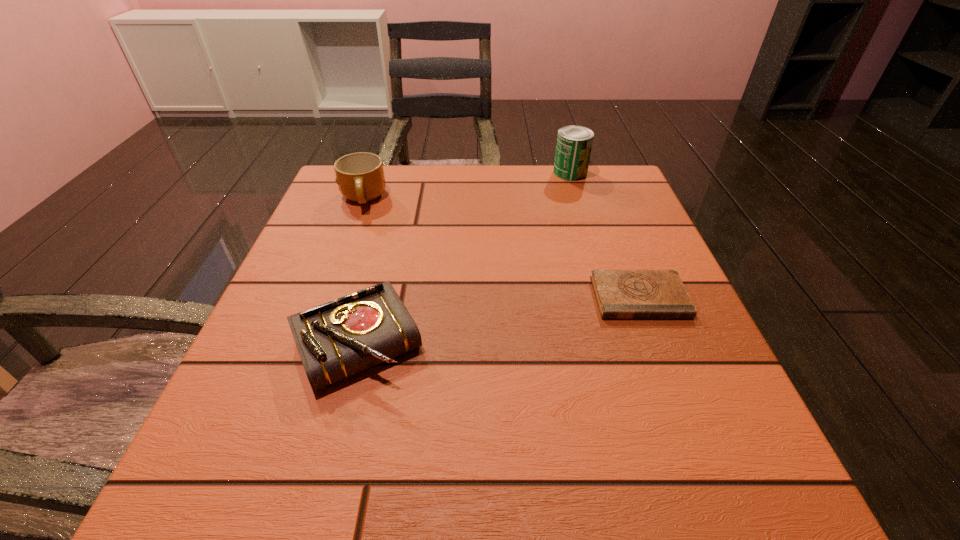
What are the coordinates of `blank space at the far edge of the desktop` in the screenshot? It's located at (539, 188).

The image size is (960, 540). Find the location of `free region at the near edge`. free region at the near edge is located at coordinates (x=425, y=449).

What are the coordinates of `vacant space at the left edge of the desktop` in the screenshot? It's located at (347, 268).

In the image, there is a desktop. Where is `vacant space at the right edge`? Image resolution: width=960 pixels, height=540 pixels. vacant space at the right edge is located at coordinates (586, 265).

Locate an element on the screen. The width and height of the screenshot is (960, 540). free space at the far right corner of the desktop is located at coordinates (579, 186).

This screenshot has width=960, height=540. What are the coordinates of `free space at the near right corner of the desktop` in the screenshot? It's located at (666, 510).

Find the location of a particular element. Image resolution: width=960 pixels, height=540 pixels. vacant space that's between the shorter diary and the taller diary is located at coordinates (498, 320).

The height and width of the screenshot is (540, 960). I want to click on free space between the second shortest object and the shortest object, so click(x=498, y=320).

Locate an element on the screen. The image size is (960, 540). vacant space that is in between the farthest object and the shortest object is located at coordinates (605, 235).

Locate an element on the screen. This screenshot has height=540, width=960. vacant point located between the farthest object and the shortest object is located at coordinates (605, 235).